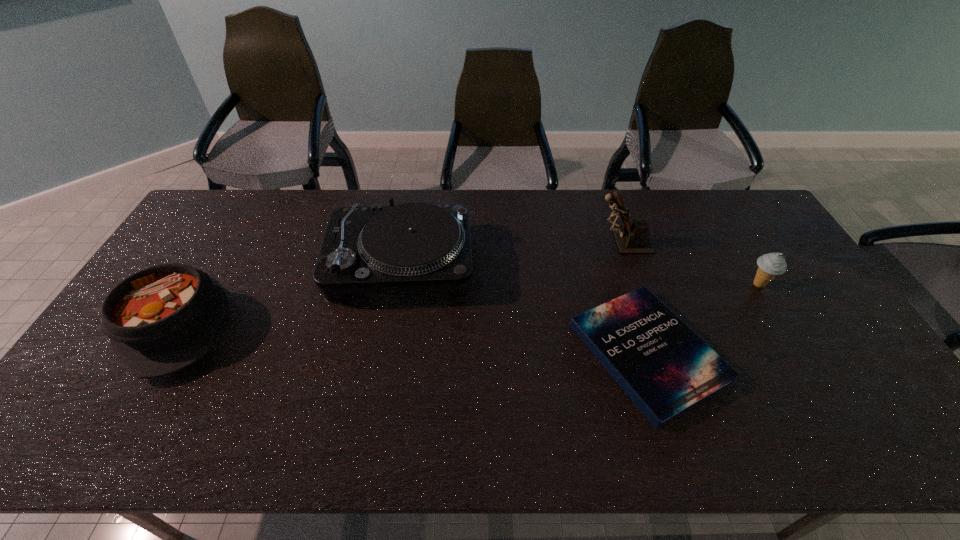
Find the location of `vacant point located 0.090m on the back of the leftmost object`. vacant point located 0.090m on the back of the leftmost object is located at coordinates (218, 256).

Identify the location of vacant space positioned on the left of the shortest object. (510, 353).

The width and height of the screenshot is (960, 540). In order to click on figurine positioned at the far edge in this screenshot , I will do `click(632, 237)`.

Identify the location of record player that is at the far edge. (413, 246).

Image resolution: width=960 pixels, height=540 pixels. I want to click on object that is positioned at the near edge, so click(666, 369).

Locate an element on the screen. object that is positioned at the left edge is located at coordinates (164, 318).

Find the location of a particular element. Image resolution: width=960 pixels, height=540 pixels. object located at the right edge is located at coordinates (771, 264).

In order to click on blank space at the far edge of the desktop in this screenshot , I will do `click(266, 203)`.

What are the coordinates of `free region at the near edge of the desktop` in the screenshot? It's located at (212, 430).

You are a GUI agent. You are given a task and a screenshot of the screen. Output one action in this format:
    pyautogui.click(x=<x>, y=<y>)
    Task: Click on the vacant space at the left edge of the desktop
    This screenshot has width=960, height=540.
    Given the screenshot: What is the action you would take?
    pyautogui.click(x=212, y=239)